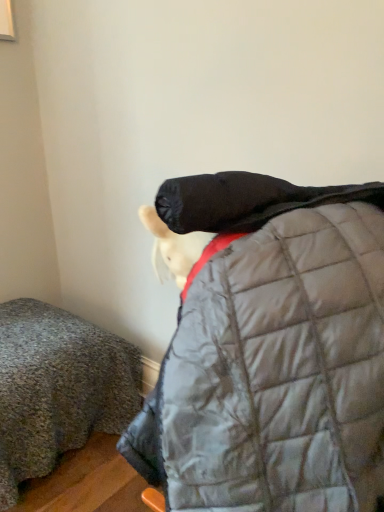
Question: Would you say textured gray blanket at lower left is part of silver quilted jacket at center's contents?

Choices:
 (A) yes
 (B) no

Answer: (B)

Question: Is silver quilted jacket at center further to camera compared to textured gray blanket at lower left?

Choices:
 (A) yes
 (B) no

Answer: (B)

Question: Is silver quilted jacket at center shorter than textured gray blanket at lower left?

Choices:
 (A) no
 (B) yes

Answer: (A)

Question: From a real-world perspective, is silver quilted jacket at center physically above textured gray blanket at lower left?

Choices:
 (A) yes
 (B) no

Answer: (A)

Question: Does silver quilted jacket at center have a lesser width compared to textured gray blanket at lower left?

Choices:
 (A) yes
 (B) no

Answer: (A)

Question: Is silver quilted jacket at center not close to textured gray blanket at lower left?

Choices:
 (A) yes
 (B) no

Answer: (B)

Question: Is textured gray blanket at lower left closer to camera compared to silver quilted jacket at center?

Choices:
 (A) yes
 (B) no

Answer: (B)

Question: Can you confirm if textured gray blanket at lower left is positioned to the right of silver quilted jacket at center?

Choices:
 (A) no
 (B) yes

Answer: (A)

Question: Does textured gray blanket at lower left lie behind silver quilted jacket at center?

Choices:
 (A) yes
 (B) no

Answer: (A)

Question: Can you confirm if textured gray blanket at lower left is smaller than silver quilted jacket at center?

Choices:
 (A) yes
 (B) no

Answer: (B)

Question: Does textured gray blanket at lower left appear on the left side of silver quilted jacket at center?

Choices:
 (A) no
 (B) yes

Answer: (B)

Question: Are textured gray blanket at lower left and silver quilted jacket at center making contact?

Choices:
 (A) yes
 (B) no

Answer: (B)

Question: Does point (196, 276) appear closer or farther from the camera than point (79, 413)?

Choices:
 (A) farther
 (B) closer

Answer: (B)